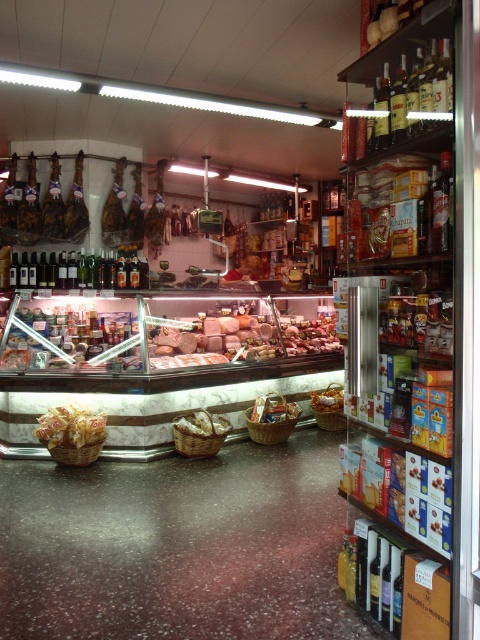
Question: Estimate the real-world distances between objects in this image. Which object is closer to the shiny glass bottles at center?

Choices:
 (A) yellow matte bread at center
 (B) semi-translucent plastic deli meat at center

Answer: (B)

Question: Can you confirm if semi-translucent plastic deli meat at center is positioned below wooden basket at center?

Choices:
 (A) no
 (B) yes

Answer: (A)

Question: Which point is closer to the camera taking this photo?

Choices:
 (A) (261, 400)
 (B) (143, 285)
 (C) (222, 428)

Answer: (C)

Question: Does semi-translucent plastic deli meat at center appear on the left side of yellow matte bread at center?

Choices:
 (A) yes
 (B) no

Answer: (B)

Question: Can you confirm if wooden shelves at right is positioned to the left of white matte bread at center?

Choices:
 (A) yes
 (B) no

Answer: (B)

Question: Considering the real-world distances, which object is farthest from the wooden basket at center?

Choices:
 (A) yellow matte bread at center
 (B) golden brown bread at center
 (C) wooden shelves at right

Answer: (C)